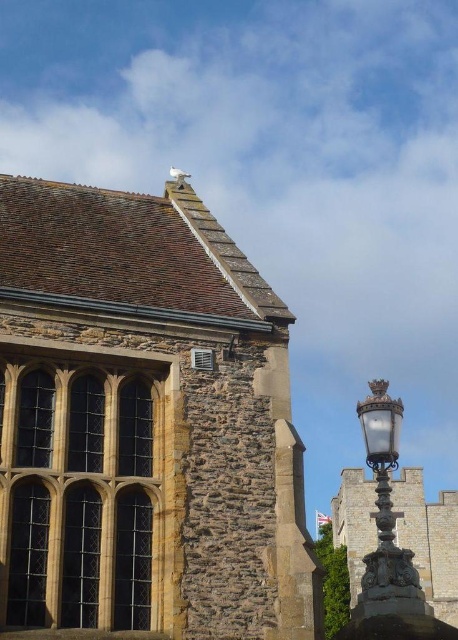
You are standing in front of the brown stone church at upper left and want to walk to the polished brass lamp post at right. Which direction should you move relative to the church?

You should move downward from the brown stone church at upper left to reach the polished brass lamp post at right since the brown stone church at upper left is positioned over the lamp post.